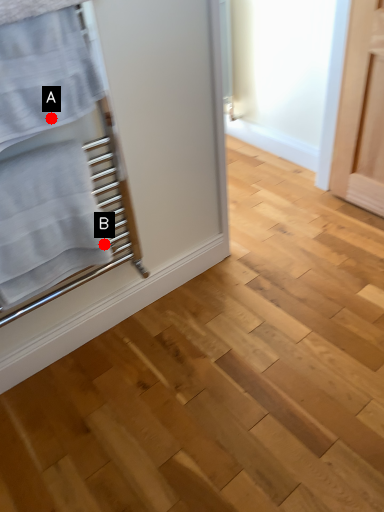
Question: Two points are circled on the image, labeled by A and B beside each circle. Which of the following is the farthest from the observer?

Choices:
 (A) A is further
 (B) B is further

Answer: (B)